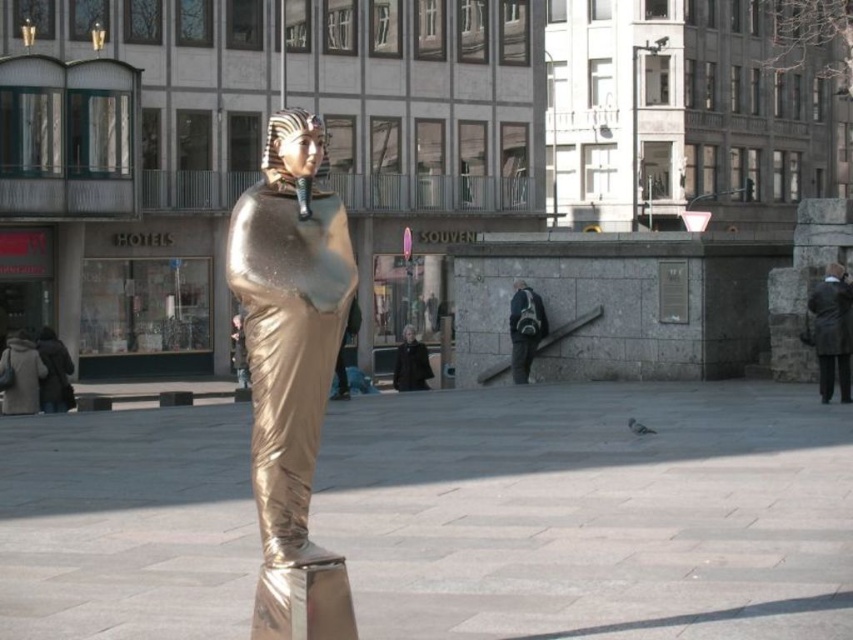
Question: Which of the following is the closest to the observer?

Choices:
 (A) (285, 384)
 (B) (544, 333)
 (C) (820, 294)

Answer: (A)

Question: Observing the image, what is the correct spatial positioning of brown leather coat at lower right in reference to dark gray backpack at center?

Choices:
 (A) above
 (B) below

Answer: (A)

Question: Does brown leather coat at lower right have a lesser width compared to dark gray backpack at center?

Choices:
 (A) no
 (B) yes

Answer: (A)

Question: Which of these objects is positioned closest to the brown leather coat at lower right?

Choices:
 (A) dark gray backpack at center
 (B) gold metallic statue at center

Answer: (A)

Question: Considering the real-world distances, which object is closest to the dark gray backpack at center?

Choices:
 (A) gold metallic statue at center
 (B) brown leather coat at lower right

Answer: (A)

Question: Is gold metallic statue at center bigger than dark gray backpack at center?

Choices:
 (A) no
 (B) yes

Answer: (B)